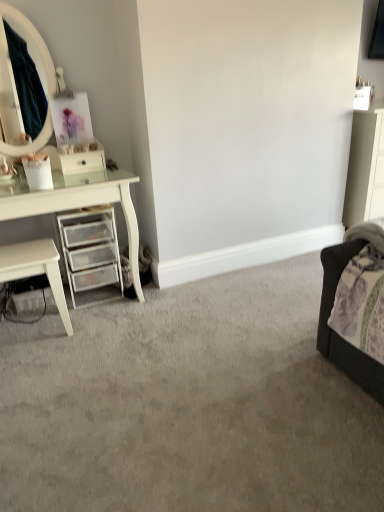
Locate an element on the screen. The width and height of the screenshot is (384, 512). free spot above white glossy drawer at left (from a real-world perspective) is located at coordinates (75, 150).